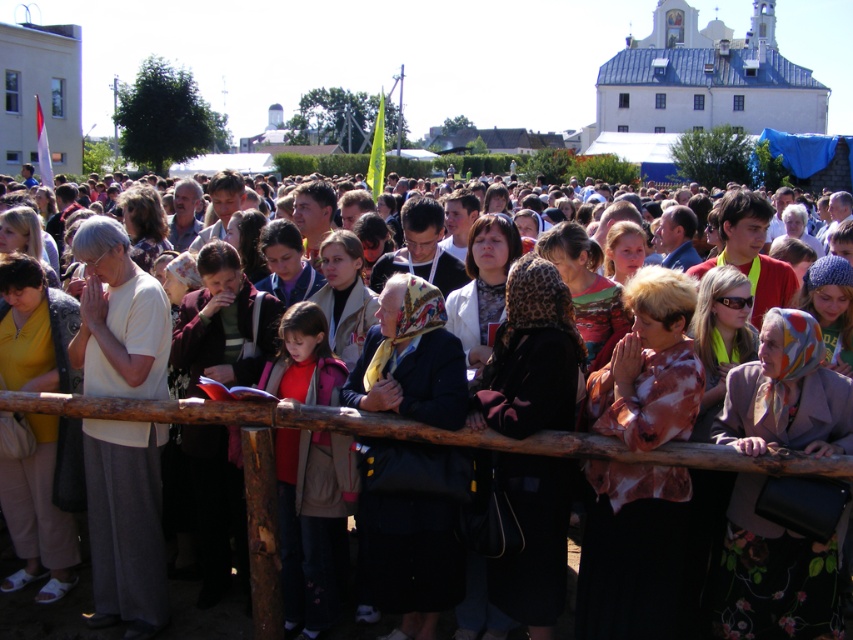
Question: Which object is the closest to the dark blue fabric coat at center?

Choices:
 (A) white matte shirt at left
 (B) matte black jacket at center

Answer: (B)

Question: Estimate the real-world distances between objects in this image. Which object is farther from the dark blue fabric coat at center?

Choices:
 (A) white matte shirt at left
 (B) matte black jacket at center

Answer: (A)

Question: Is white matte shirt at left to the left of matte black jacket at center from the viewer's perspective?

Choices:
 (A) yes
 (B) no

Answer: (A)

Question: Among these objects, which one is farthest from the camera?

Choices:
 (A) white matte shirt at left
 (B) dark blue fabric coat at center
 (C) matte black jacket at center

Answer: (A)

Question: In this image, where is white matte shirt at left located relative to matte black jacket at center?

Choices:
 (A) below
 (B) above

Answer: (B)

Question: Can you confirm if white matte shirt at left is bigger than dark blue fabric coat at center?

Choices:
 (A) no
 (B) yes

Answer: (B)